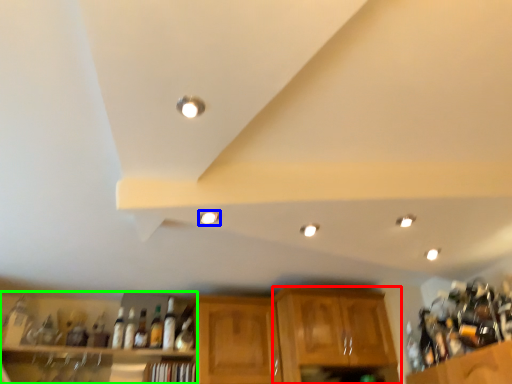
Question: Based on their relative distances, which object is farther from cabinetry (highlighted by a red box)? Choose from lighting (highlighted by a blue box) and shelf (highlighted by a green box).

Choices:
 (A) lighting
 (B) shelf

Answer: (A)